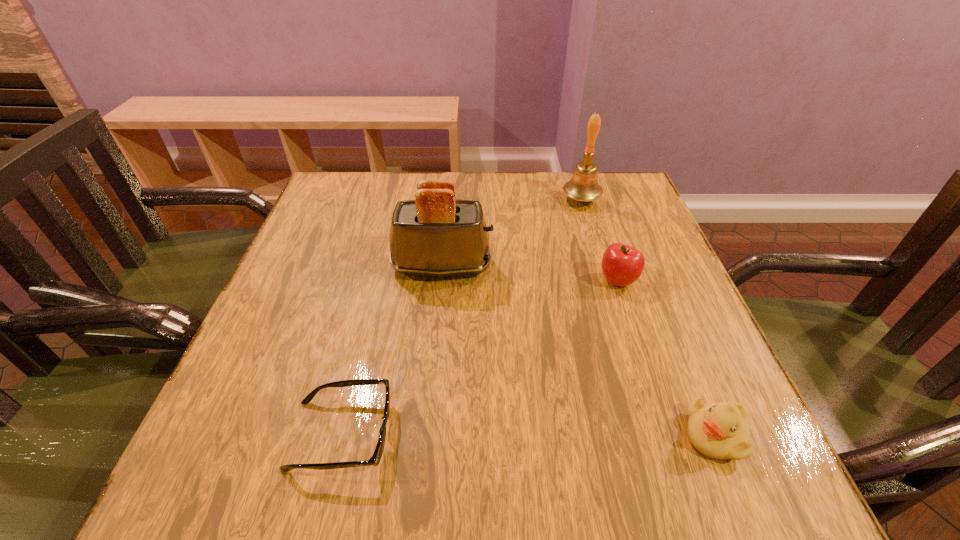
Where is `bell`? Image resolution: width=960 pixels, height=540 pixels. bell is located at coordinates (583, 186).

This screenshot has height=540, width=960. Find the location of `toaster`. toaster is located at coordinates (435, 235).

Image resolution: width=960 pixels, height=540 pixels. Find the location of `apple`. apple is located at coordinates pyautogui.click(x=622, y=265).

Locate an element on the screen. The width and height of the screenshot is (960, 540). the fourth tallest object is located at coordinates (721, 431).

You are a GUI agent. You are given a task and a screenshot of the screen. Output one action in this format:
    pyautogui.click(x=<x>, y=<y>)
    Task: Click on the spectacles
    
    Given the screenshot: What is the action you would take?
    pyautogui.click(x=376, y=457)

Image resolution: width=960 pixels, height=540 pixels. Identify the location of blank space located 0.220m on the left of the farthest object. (479, 199).

You are a GUI agent. You are given a task and a screenshot of the screen. Output one action in this format:
    pyautogui.click(x=<x>, y=<y>)
    Task: Click on the vacant space located 0.100m on the side of the toaster with the control lever
    The width and height of the screenshot is (960, 540).
    Given the screenshot: What is the action you would take?
    pyautogui.click(x=538, y=266)

Find the location of `vacant area situated 0.260m on the left of the apple`. vacant area situated 0.260m on the left of the apple is located at coordinates (478, 280).

You are a GUI agent. You are given a task and a screenshot of the screen. Output one action in this format:
    pyautogui.click(x=<x>, y=<y>)
    Task: Click on the blank space located 0.340m on the beak of the duckling
    The width and height of the screenshot is (960, 540).
    Given the screenshot: What is the action you would take?
    pyautogui.click(x=469, y=435)

Where is `vacant space located 0.320m on the beak of the duckling`? The image size is (960, 540). vacant space located 0.320m on the beak of the duckling is located at coordinates (482, 435).